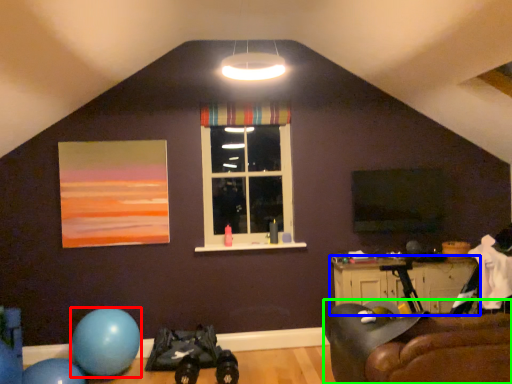
Question: Estimate the real-world distances between objects in this image. Which object is farther from balloon (highlighted by a red box), table (highlighted by a blue box) or studio couch (highlighted by a green box)?

Choices:
 (A) table
 (B) studio couch

Answer: (B)